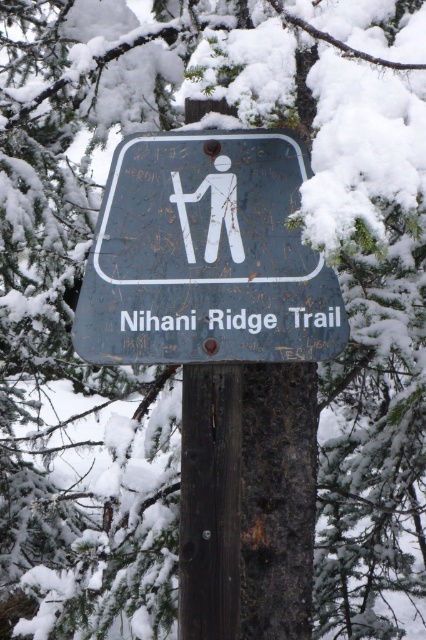
Question: Which object is farther from the camera taking this photo?

Choices:
 (A) matte blue sign at center
 (B) brown wood post at center

Answer: (B)

Question: In this image, where is matte blue sign at center located relative to brown wood post at center?

Choices:
 (A) left
 (B) right

Answer: (A)

Question: Does matte blue sign at center lie behind brown wood post at center?

Choices:
 (A) no
 (B) yes

Answer: (A)

Question: Is matte blue sign at center bigger than brown wood post at center?

Choices:
 (A) yes
 (B) no

Answer: (A)

Question: Which object is closer to the camera taking this photo?

Choices:
 (A) matte blue sign at center
 (B) brown wood post at center

Answer: (A)

Question: Which point appears closest to the camera in this image?

Choices:
 (A) (216, 627)
 (B) (94, 348)

Answer: (B)